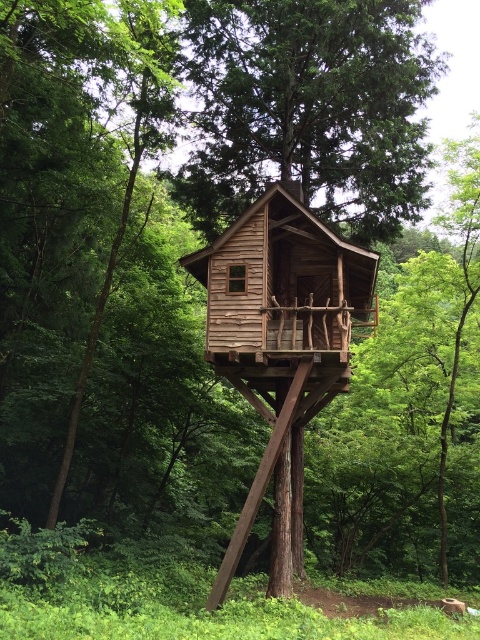
Question: Considering the real-world distances, which object is closest to the brown wooden house at center?

Choices:
 (A) wooden cabin at center
 (B) brown wooden cabin at center

Answer: (A)

Question: Based on their relative distances, which object is nearer to the wooden cabin at center?

Choices:
 (A) brown wooden cabin at center
 (B) brown wooden house at center

Answer: (B)

Question: Is brown wooden cabin at center thinner than wooden cabin at center?

Choices:
 (A) yes
 (B) no

Answer: (A)

Question: Which object is the closest to the brown wooden cabin at center?

Choices:
 (A) brown wooden house at center
 (B) wooden cabin at center

Answer: (B)

Question: Is the position of brown wooden cabin at center less distant than that of brown wooden house at center?

Choices:
 (A) no
 (B) yes

Answer: (B)

Question: Where is brown wooden house at center located in relation to wooden cabin at center in the image?

Choices:
 (A) right
 (B) left

Answer: (A)